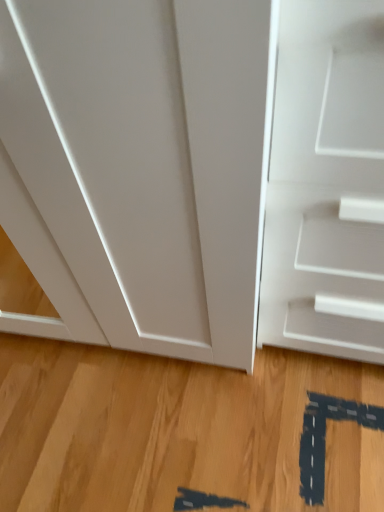
In order to face white matte door at right, should I rotate leftwards or rightwards?

Rotate right and turn 20.766 degrees.

Measure the distance between point [300,226] and camera.

Point [300,226] and camera are 30.00 inches apart from each other.

You are a GUI agent. You are given a task and a screenshot of the screen. Output one action in this format:
    pyautogui.click(x=<x>, y=<y>)
    Task: Click on the white matte door at right
    This screenshot has height=512, width=384.
    Given the screenshot: What is the action you would take?
    pyautogui.click(x=326, y=183)

Describe the element at coordinates (326, 183) in the screenshot. I see `white matte door at right` at that location.

What is the approximate width of white matte door at right?

white matte door at right is 23.32 centimeters wide.

This screenshot has width=384, height=512. I want to click on light brown wood flooring at center, so click(x=175, y=429).

What do you see at coordinates (175, 429) in the screenshot?
I see `light brown wood flooring at center` at bounding box center [175, 429].

Image resolution: width=384 pixels, height=512 pixels. Identify the location of white matte door at right. (326, 183).

Does light brown wood flooring at center appear on the left side of white matte door at right?

Yes, light brown wood flooring at center is to the left of white matte door at right.

Is the depth of light brown wood flooring at center less than that of white matte door at right?

No, light brown wood flooring at center is further to the viewer.

Is point (306, 391) behind point (310, 329)?

Yes, point (306, 391) is behind point (310, 329).

From the image's perspective, between light brown wood flooring at center and white matte door at right, which one is located above?

white matte door at right appears higher in the image.

From a real-world perspective, is light brown wood flooring at center physically above white matte door at right?

Actually, light brown wood flooring at center is physically below white matte door at right in the real world.

Can you confirm if light brown wood flooring at center is thinner than white matte door at right?

No, light brown wood flooring at center is not thinner than white matte door at right.

From their relative heights in the image, would you say light brown wood flooring at center is taller or shorter than white matte door at right?

Considering their sizes, light brown wood flooring at center has less height than white matte door at right.

Is light brown wood flooring at center smaller than white matte door at right?

Indeed, light brown wood flooring at center has a smaller size compared to white matte door at right.

Can we say light brown wood flooring at center lies outside white matte door at right?

Indeed, light brown wood flooring at center is completely outside white matte door at right.

Does light brown wood flooring at center touch white matte door at right?

No, light brown wood flooring at center is not beside white matte door at right.

Is light brown wood flooring at center turned away from white matte door at right?

No, light brown wood flooring at center is not facing away from white matte door at right.

Consider the image. What's the angular difference between light brown wood flooring at center and white matte door at right's facing directions?

The angular difference between light brown wood flooring at center and white matte door at right is 90.4 degrees.

At what (x,y) coordinates should I click in order to perform the action: click on door located in front of the light brown wood flooring at center. Please return your answer as a coordinate pair (x, y). This screenshot has width=384, height=512. Looking at the image, I should click on (326, 183).

Is white matte door at right to the left of light brown wood flooring at center from the viewer's perspective?

In fact, white matte door at right is to the right of light brown wood flooring at center.

Does white matte door at right come behind light brown wood flooring at center?

That is False.

Which is in front, point (275, 131) or point (83, 506)?

The point (275, 131) is more forward.

From the image's perspective, is white matte door at right positioned above or below light brown wood flooring at center?

From the image's perspective, white matte door at right appears above light brown wood flooring at center.

From a real-world perspective, is white matte door at right above or below light brown wood flooring at center?

From a real-world perspective, white matte door at right is physically above light brown wood flooring at center.

Which object is thinner, white matte door at right or light brown wood flooring at center?

white matte door at right.

Which of these two, white matte door at right or light brown wood flooring at center, stands taller?

Standing taller between the two is white matte door at right.

Considering the relative sizes of white matte door at right and light brown wood flooring at center in the image provided, is white matte door at right smaller than light brown wood flooring at center?

Incorrect, white matte door at right is not smaller in size than light brown wood flooring at center.

Is white matte door at right inside the boundaries of light brown wood flooring at center, or outside?

white matte door at right lies outside light brown wood flooring at center.

Is white matte door at right positioned far away from light brown wood flooring at center?

No, white matte door at right is in close proximity to light brown wood flooring at center.

Is white matte door at right looking in the opposite direction of light brown wood flooring at center?

No, light brown wood flooring at center is not at the back of white matte door at right.

What's the angular difference between white matte door at right and light brown wood flooring at center's facing directions?

90.4 degrees separate the facing orientations of white matte door at right and light brown wood flooring at center.

How much distance is there between white matte door at right and light brown wood flooring at center?

The distance of white matte door at right from light brown wood flooring at center is 18.75 inches.

You are a GUI agent. You are given a task and a screenshot of the screen. Output one action in this format:
    pyautogui.click(x=<x>, y=<y>)
    Task: Click on the door in front of the light brown wood flooring at center
    The image size is (384, 512).
    Given the screenshot: What is the action you would take?
    coord(326,183)

Where is `hardwood to the left of white matte door at right`? hardwood to the left of white matte door at right is located at coordinates (175, 429).

Locate an element on the screen. Image resolution: width=384 pixels, height=512 pixels. door above the light brown wood flooring at center (from the image's perspective) is located at coordinates click(326, 183).